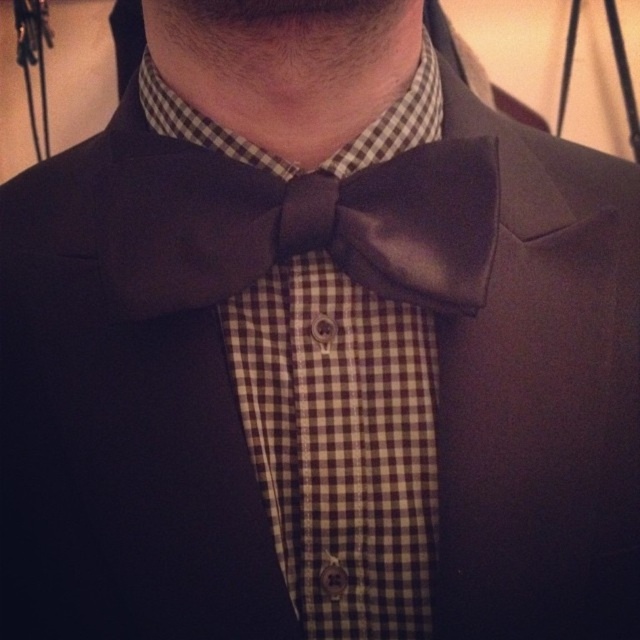
Looking at this image, between brown checkered shirt at center and shiny brown bow tie at center, which one is positioned lower?

brown checkered shirt at center is lower down.

Does point (291, 333) come in front of point (276, 188)?

No.

I want to click on brown checkered shirt at center, so click(340, 444).

Does brown checkered shirt at center have a greater height compared to white checkered fabric at center?

Yes.

Can you confirm if brown checkered shirt at center is wider than white checkered fabric at center?

No, brown checkered shirt at center is not wider than white checkered fabric at center.

Locate an element on the screen. brown checkered shirt at center is located at coordinates (340, 444).

Who is taller, shiny brown bow tie at center or white checkered fabric at center?

With more height is shiny brown bow tie at center.

Is point (225, 298) farther from viewer compared to point (394, 88)?

No, it is not.

What do you see at coordinates (292, 225) in the screenshot? This screenshot has width=640, height=640. I see `shiny brown bow tie at center` at bounding box center [292, 225].

The width and height of the screenshot is (640, 640). Identify the location of shiny brown bow tie at center. (292, 225).